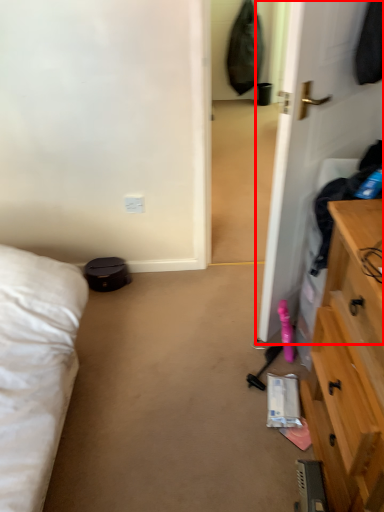
Question: In this image, where is door (annotated by the red box) located relative to electric outlet?

Choices:
 (A) left
 (B) right

Answer: (B)